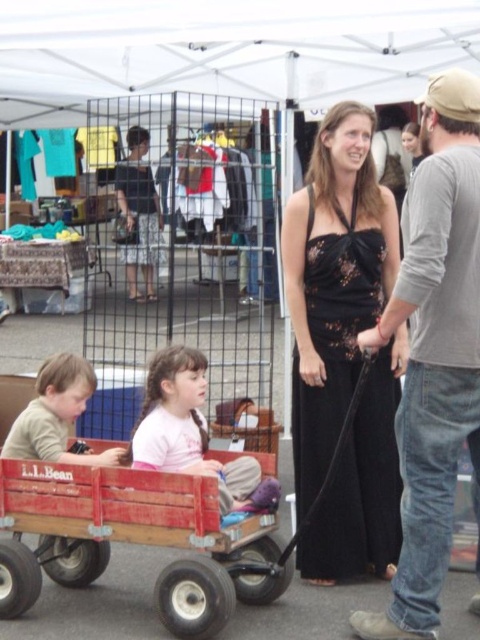
Question: Which point is farther to the camera?

Choices:
 (A) (237, 598)
 (B) (216, 467)
 (C) (19, 422)
 (D) (427, 621)

Answer: (C)

Question: Is the position of wooden wagon at center more distant than that of matte beige shirt at lower left?

Choices:
 (A) yes
 (B) no

Answer: (B)

Question: Among these objects, which one is nearest to the camera?

Choices:
 (A) wooden wagon at center
 (B) pink fabric shirt at center
 (C) gray long-sleeved shirt at center
 (D) black lace dress at center

Answer: (C)

Question: Is black lace dress at center positioned at the back of matte beige shirt at lower left?

Choices:
 (A) no
 (B) yes

Answer: (B)

Question: Which point is closer to the camera taking this photo?

Choices:
 (A) (369, 310)
 (B) (166, 401)
 (C) (67, 445)
 (D) (47, 556)

Answer: (B)

Question: Can you confirm if wooden wagon at center is positioned below matte beige shirt at lower left?

Choices:
 (A) yes
 (B) no

Answer: (A)